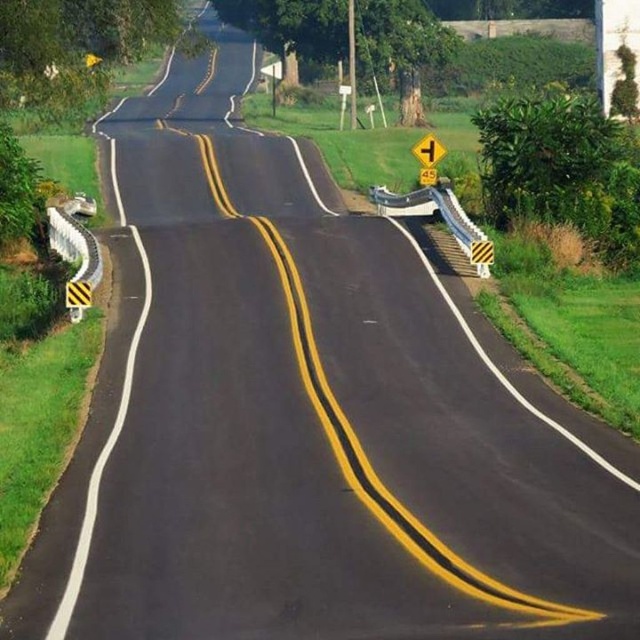
Is yellow plastic sign at upper center below yellow striped traffic sign at center?

No.

Describe the element at coordinates (428, 150) in the screenshot. The height and width of the screenshot is (640, 640). I see `yellow plastic sign at upper center` at that location.

Find the location of a particular element. yellow plastic sign at upper center is located at coordinates (428, 150).